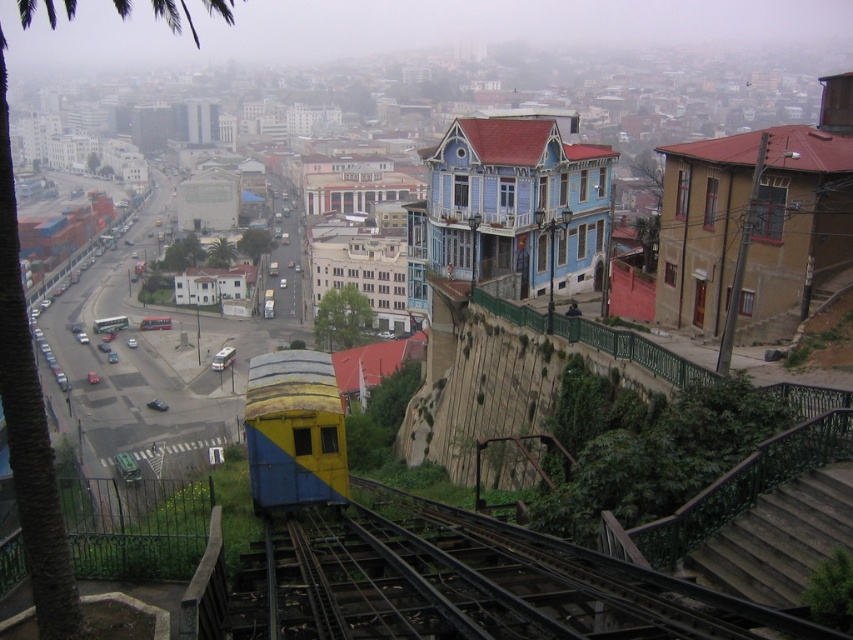
Which is in front, point (68, 557) or point (258, 374)?

Positioned in front is point (68, 557).

Does green leafy palm tree at left appear on the left side of yellow matte train at center?

Correct, you'll find green leafy palm tree at left to the left of yellow matte train at center.

This screenshot has height=640, width=853. I want to click on green leafy palm tree at left, so click(28, 422).

Locate an element on the screen. This screenshot has height=640, width=853. green leafy palm tree at left is located at coordinates (28, 422).